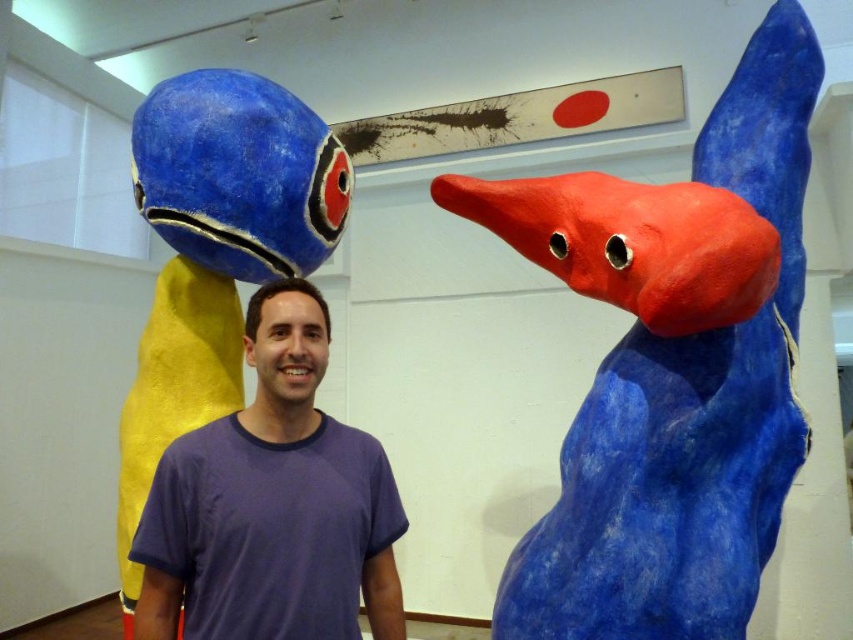
Based on the photo, you are an artist trying to place two points on a canvas. The first point is at position point(648, 477) and the second is at point(254, 380). According to the scene, which point is closer to the viewer?

Point(648, 477) is in front of point0.599, 0.299, so it is closer to the viewer.